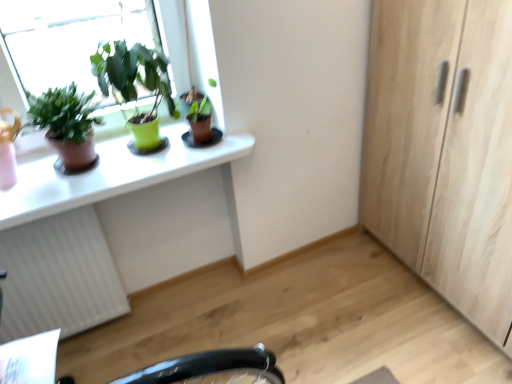
Question: In terms of width, does white glossy desk at upper left look wider or thinner when compared to green matte pot at upper left, the second houseplant positioned from the right?

Choices:
 (A) thin
 (B) wide

Answer: (B)

Question: Considering the positions of white glossy desk at upper left and green matte pot at upper left, the second houseplant positioned from the right, in the image, is white glossy desk at upper left taller or shorter than green matte pot at upper left, the second houseplant positioned from the right,?

Choices:
 (A) tall
 (B) short

Answer: (B)

Question: Estimate the real-world distances between objects in this image. Which object is farther from the light wood cabinet at right?

Choices:
 (A) white glossy desk at upper left
 (B) white textured radiator at lower left
 (C) green matte pot at upper left, the second houseplant positioned from the right
 (D) matte brown pot at upper left, arranged as the 3th houseplant when viewed from the right
 (E) matte brown pot at upper center, which ranks as the 1th houseplant in right-to-left order

Answer: (B)

Question: Which of these objects is positioned farthest from the white textured radiator at lower left?

Choices:
 (A) matte brown pot at upper center, which ranks as the 1th houseplant in right-to-left order
 (B) white glossy computer desk at upper left
 (C) matte brown pot at upper left, placed as the first houseplant when sorted from left to right
 (D) white glossy desk at upper left
 (E) light wood cabinet at right

Answer: (E)